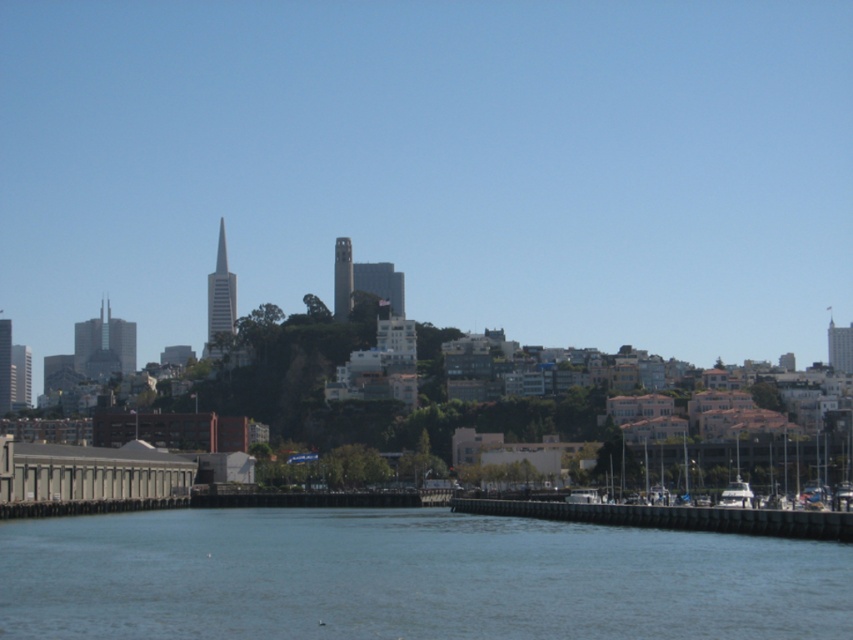
Question: Does blue water at center appear on the right side of brown wooden dock at lower center?

Choices:
 (A) no
 (B) yes

Answer: (A)

Question: Does blue water at center have a greater width compared to brown wooden dock at lower center?

Choices:
 (A) yes
 (B) no

Answer: (A)

Question: Is blue water at center bigger than brown wooden dock at lower center?

Choices:
 (A) yes
 (B) no

Answer: (A)

Question: Which point appears farthest from the camera in this image?

Choices:
 (A) (756, 518)
 (B) (180, 628)

Answer: (A)